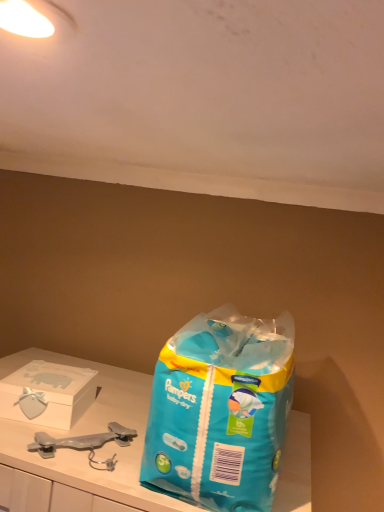
Measure the distance between blue plastic bag at center and camera.

The depth of blue plastic bag at center is 24.07 inches.

Describe the element at coordinates (221, 410) in the screenshot. I see `blue plastic bag at center` at that location.

At what (x,y) coordinates should I click in order to perform the action: click on blue plastic bag at center. Please return your answer as a coordinate pair (x, y). This screenshot has width=384, height=512. Looking at the image, I should click on (221, 410).

Measure the distance between point (x=2, y=403) and camera.

Point (x=2, y=403) and camera are 34.57 inches apart from each other.

The height and width of the screenshot is (512, 384). I want to click on matte white box at left, so click(x=49, y=393).

This screenshot has width=384, height=512. What do you see at coordinates (49, 393) in the screenshot? I see `matte white box at left` at bounding box center [49, 393].

The height and width of the screenshot is (512, 384). Identify the location of blue plastic bag at center. (221, 410).

Is matte white box at left at the left side of blue plastic bag at center?

Yes.

Relative to blue plastic bag at center, is matte white box at left in front or behind?

Clearly, matte white box at left is behind blue plastic bag at center.

Which is less distant, (x=1, y=381) or (x=239, y=366)?

Clearly, point (x=1, y=381) is more distant from the camera than point (x=239, y=366).

From the image's perspective, is matte white box at left above blue plastic bag at center?

Incorrect, from the image's perspective, matte white box at left is lower than blue plastic bag at center.

From a real-world perspective, is matte white box at left above or below blue plastic bag at center?

Result: matte white box at left is situated lower than blue plastic bag at center in the real world.

Between matte white box at left and blue plastic bag at center, which one has larger width?

With larger width is blue plastic bag at center.

Considering the sizes of objects matte white box at left and blue plastic bag at center in the image provided, who is shorter, matte white box at left or blue plastic bag at center?

Standing shorter between the two is matte white box at left.

Which of these two, matte white box at left or blue plastic bag at center, is bigger?

blue plastic bag at center.

Is matte white box at left positioned beyond the bounds of blue plastic bag at center?

matte white box at left is positioned outside blue plastic bag at center.

Are matte white box at left and blue plastic bag at center far apart?

No, matte white box at left is not far away from blue plastic bag at center.

Is matte white box at left oriented towards blue plastic bag at center?

No, matte white box at left is not turned towards blue plastic bag at center.

Can you tell me how much matte white box at left and blue plastic bag at center differ in facing direction?

The angular difference between matte white box at left and blue plastic bag at center is 10.2 degrees.

Find the location of a particular element. shopping bag in front of the matte white box at left is located at coordinates (221, 410).

From the picture: Between blue plastic bag at center and matte white box at left, which one appears on the right side from the viewer's perspective?

From the viewer's perspective, blue plastic bag at center appears more on the right side.

Considering the positions of objects blue plastic bag at center and matte white box at left in the image provided, who is behind, blue plastic bag at center or matte white box at left?

matte white box at left is behind.

Considering the positions of point (247, 406) and point (48, 419), is point (247, 406) closer or farther from the camera than point (48, 419)?

Clearly, point (247, 406) is closer to the camera than point (48, 419).

From the image's perspective, is blue plastic bag at center located above or below matte white box at left?

From the image's perspective, blue plastic bag at center appears above matte white box at left.

From a real-world perspective, is blue plastic bag at center beneath matte white box at left?

Actually, blue plastic bag at center is physically above matte white box at left in the real world.

Which object is wider, blue plastic bag at center or matte white box at left?

blue plastic bag at center is wider.

From their relative heights in the image, would you say blue plastic bag at center is taller or shorter than matte white box at left?

blue plastic bag at center is taller than matte white box at left.

Considering the sizes of blue plastic bag at center and matte white box at left in the image, is blue plastic bag at center bigger or smaller than matte white box at left?

blue plastic bag at center is bigger than matte white box at left.

Is blue plastic bag at center spatially inside matte white box at left, or outside of it?

blue plastic bag at center is located beyond the bounds of matte white box at left.

Is there a large distance between blue plastic bag at center and matte white box at left?

No.

Is blue plastic bag at center positioned with its back to matte white box at left?

No.

Where is `shopping bag that appears in front of the matte white box at left`? The image size is (384, 512). shopping bag that appears in front of the matte white box at left is located at coordinates (221, 410).

At what (x,y) coordinates should I click in order to perform the action: click on shopping bag that appears in front of the matte white box at left. Please return your answer as a coordinate pair (x, y). Image resolution: width=384 pixels, height=512 pixels. Looking at the image, I should click on point(221,410).

Identify the location of shopping bag positioned vertically above the matte white box at left (from a real-world perspective). This screenshot has height=512, width=384. (221, 410).